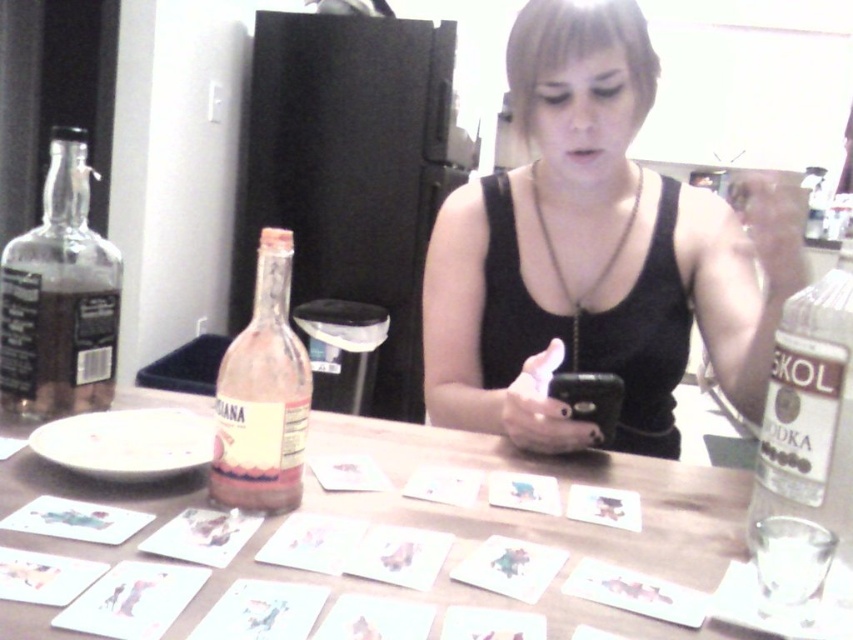
Question: Does transparent glass bottle at left appear under black leather necklace at center?

Choices:
 (A) no
 (B) yes

Answer: (B)

Question: Which point is closer to the camera?

Choices:
 (A) transparent glass bottle at right
 (B) black matte tank top at center
 (C) wooden table at center

Answer: (C)

Question: Can you confirm if transparent glass bottle at left is positioned above transparent glass bottle at right?

Choices:
 (A) yes
 (B) no

Answer: (A)

Question: Which point appears closest to the camera in this image?

Choices:
 (A) click(36, 332)
 (B) click(624, 3)
 (C) click(241, 424)
 (D) click(788, 364)

Answer: (D)

Question: Can you confirm if wooden table at center is positioned above transparent glass bottle at right?

Choices:
 (A) yes
 (B) no

Answer: (B)

Question: Which of the following is the closest to the observer?

Choices:
 (A) transparent glass bottle at left
 (B) wooden table at center
 (C) black matte tank top at center
 (D) pink glass bottle at center-left

Answer: (B)